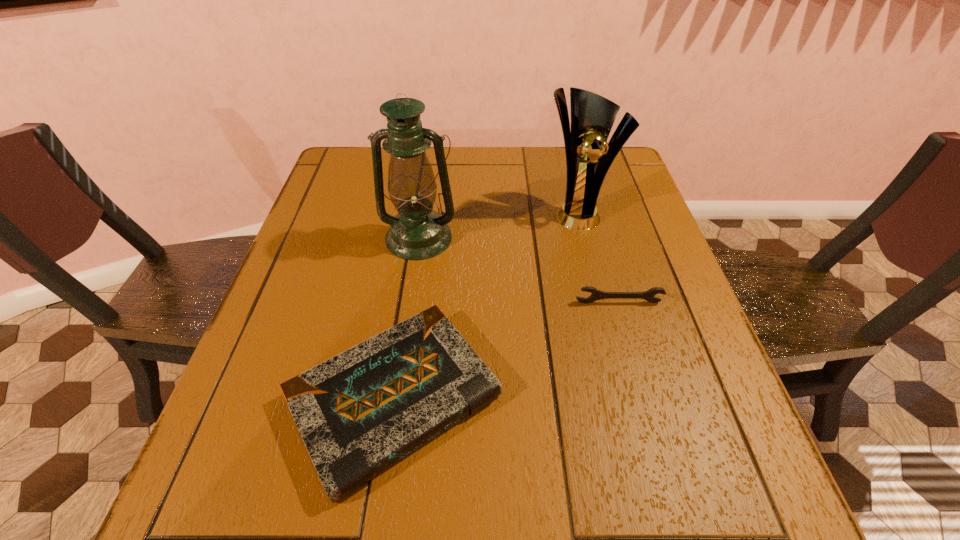
This screenshot has height=540, width=960. I want to click on oil lamp, so click(417, 232).

Where is `award`? The image size is (960, 540). award is located at coordinates (592, 116).

In order to click on wrench in this screenshot , I will do `click(596, 294)`.

I want to click on the nearest object, so click(359, 412).

Where is `free location located 0.280m on the back of the oil lamp`? The image size is (960, 540). free location located 0.280m on the back of the oil lamp is located at coordinates (430, 159).

This screenshot has width=960, height=540. What are the coordinates of `vacant area situated 0.300m at the front of the award, where the globe is visible` in the screenshot? It's located at click(604, 327).

Identify the location of free region located on the open ends of the third farthest object. Image resolution: width=960 pixels, height=540 pixels. (628, 334).

Identify the location of free space located on the back of the nearest object. Image resolution: width=960 pixels, height=540 pixels. (415, 261).

What are the coordinates of `object that is at the near edge` in the screenshot? It's located at (359, 412).

At what (x,y) coordinates should I click in order to perform the action: click on object that is at the left edge. Please return your answer as a coordinate pair (x, y). Looking at the image, I should click on (359, 412).